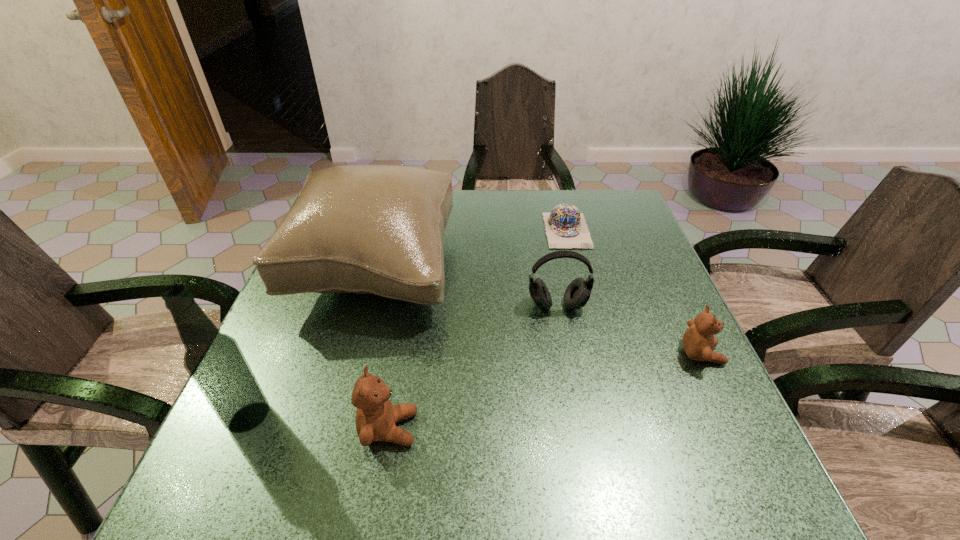
Identify the location of the nearer teddy bear. The width and height of the screenshot is (960, 540). (376, 416).

Identify the location of the taller teddy bear. This screenshot has width=960, height=540. (376, 416).

Find the location of `the third nearest object`. the third nearest object is located at coordinates (698, 341).

This screenshot has height=540, width=960. I want to click on the second shortest object, so coord(698,341).

In order to click on the second tallest object in this screenshot , I will do tap(365, 229).

This screenshot has height=540, width=960. What are the coordinates of `cap` in the screenshot? It's located at (566, 227).

Identify the location of headset. This screenshot has width=960, height=540. (578, 292).

At what (x,y) coordinates should I click in order to perform the action: click on alcohol. Please return your answer as a coordinate pair (x, y). This screenshot has width=960, height=540. Looking at the image, I should click on (215, 362).

I want to click on vacant point located on the face of the left teddy bear, so click(622, 429).

Where is `vacant position located 0.260m on the front of the cushion`? vacant position located 0.260m on the front of the cushion is located at coordinates (328, 440).